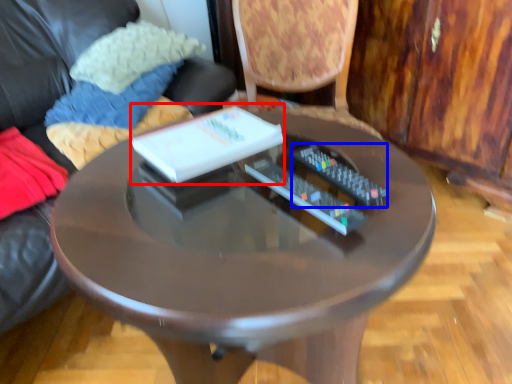
Question: Which object appears closest to the camera in this image, book (highlighted by a red box) or remote control (highlighted by a blue box)?

Choices:
 (A) book
 (B) remote control

Answer: (B)